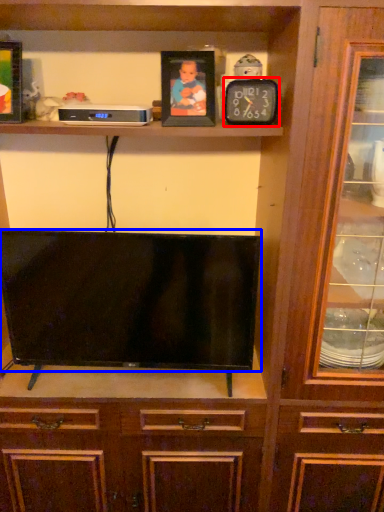
Question: Which object appears closest to the camera in this image, clock (highlighted by a red box) or television (highlighted by a blue box)?

Choices:
 (A) clock
 (B) television

Answer: (A)